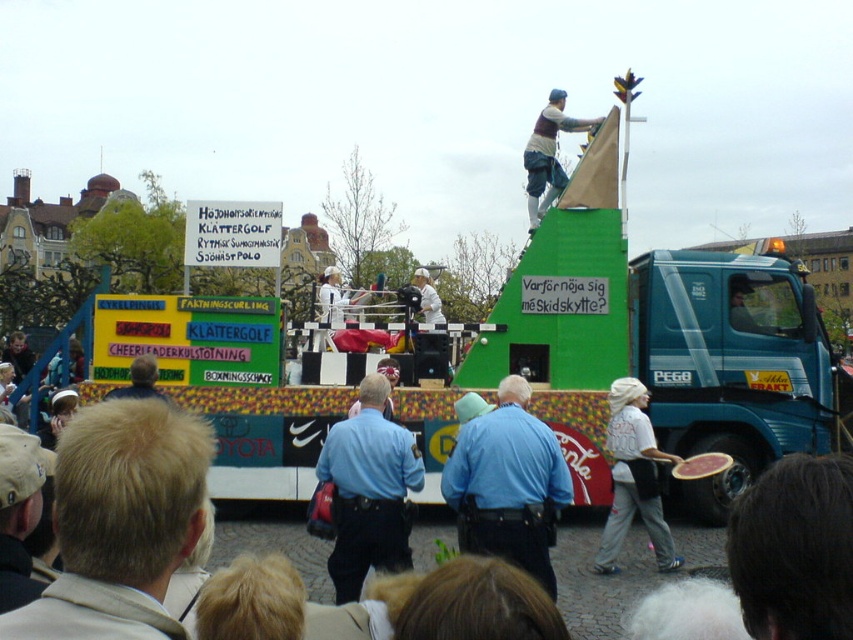
You are a participant in the parade and need to retrieve your uniform. You see the blue uniform shirt at center and the blue uniform at center. Which one is closer to you?

The blue uniform shirt at center is 5.11 meters away from the blue uniform at center, so the blue uniform shirt at center is closer to you than the blue uniform at center.

You are a photographer at the event and want to capture both the blonde hair at center and the blue uniform shirt at center in a single photo. Which object should you focus on first to ensure both are in frame?

You should focus on the blonde hair at center first since it has a larger size compared to the blue uniform shirt at center, ensuring it fits within the frame while the smaller blue uniform shirt at center will also be captured.